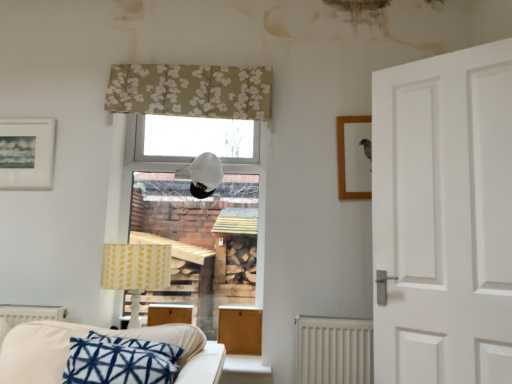
Question: From the image's perspective, would you say white fabric couch at lower left is positioned over white matte table lamp at center, marked as the 1th table lamp in a top-to-bottom arrangement?

Choices:
 (A) yes
 (B) no

Answer: (B)

Question: From a real-world perspective, is white fabric couch at lower left over white matte table lamp at center, marked as the 1th table lamp in a top-to-bottom arrangement?

Choices:
 (A) yes
 (B) no

Answer: (B)

Question: Is white fabric couch at lower left facing towards white matte table lamp at center, marked as the 2th table lamp in a left-to-right arrangement?

Choices:
 (A) no
 (B) yes

Answer: (A)

Question: Is white fabric couch at lower left far away from white matte table lamp at center, marked as the 2th table lamp in a left-to-right arrangement?

Choices:
 (A) yes
 (B) no

Answer: (A)

Question: Is white fabric couch at lower left bigger than white matte table lamp at center, the second table lamp in the bottom-to-top sequence?

Choices:
 (A) yes
 (B) no

Answer: (A)

Question: From the image's perspective, is yellow fabric lampshade at lower left, which appears as the second table lamp when viewed from the top, located above or below white matte table lamp at center, marked as the 2th table lamp in a left-to-right arrangement?

Choices:
 (A) below
 (B) above

Answer: (A)

Question: From a real-world perspective, is yellow fabric lampshade at lower left, the first table lamp when ordered from bottom to top, positioned above or below white matte table lamp at center, marked as the 2th table lamp in a left-to-right arrangement?

Choices:
 (A) below
 (B) above

Answer: (A)

Question: Relative to white matte table lamp at center, marked as the first table lamp in a right-to-left arrangement, is yellow fabric lampshade at lower left, the 2th table lamp viewed from the right, in front or behind?

Choices:
 (A) front
 (B) behind

Answer: (A)

Question: Is yellow fabric lampshade at lower left, the first table lamp when ordered from bottom to top, spatially inside white matte table lamp at center, marked as the 1th table lamp in a top-to-bottom arrangement, or outside of it?

Choices:
 (A) outside
 (B) inside

Answer: (A)

Question: In the image, is wooden box at center on the left side or the right side of white textured radiator at lower center, acting as the second radiator starting from the left?

Choices:
 (A) right
 (B) left

Answer: (B)

Question: In terms of width, does wooden box at center look wider or thinner when compared to white textured radiator at lower center, acting as the second radiator starting from the left?

Choices:
 (A) wide
 (B) thin

Answer: (B)

Question: Is point (236, 339) closer or farther from the camera than point (326, 339)?

Choices:
 (A) farther
 (B) closer

Answer: (A)

Question: Considering the positions of wooden box at center and white textured radiator at lower center, which appears as the 1th radiator when viewed from the right, in the image, is wooden box at center taller or shorter than white textured radiator at lower center, which appears as the 1th radiator when viewed from the right,?

Choices:
 (A) tall
 (B) short

Answer: (B)

Question: From the image's perspective, is white matte radiator at lower left, positioned as the second radiator in right-to-left order, above or below white fabric couch at lower left?

Choices:
 (A) below
 (B) above

Answer: (A)

Question: In the image, is white matte radiator at lower left, which is counted as the first radiator, starting from the left, positioned in front of or behind white fabric couch at lower left?

Choices:
 (A) behind
 (B) front

Answer: (A)